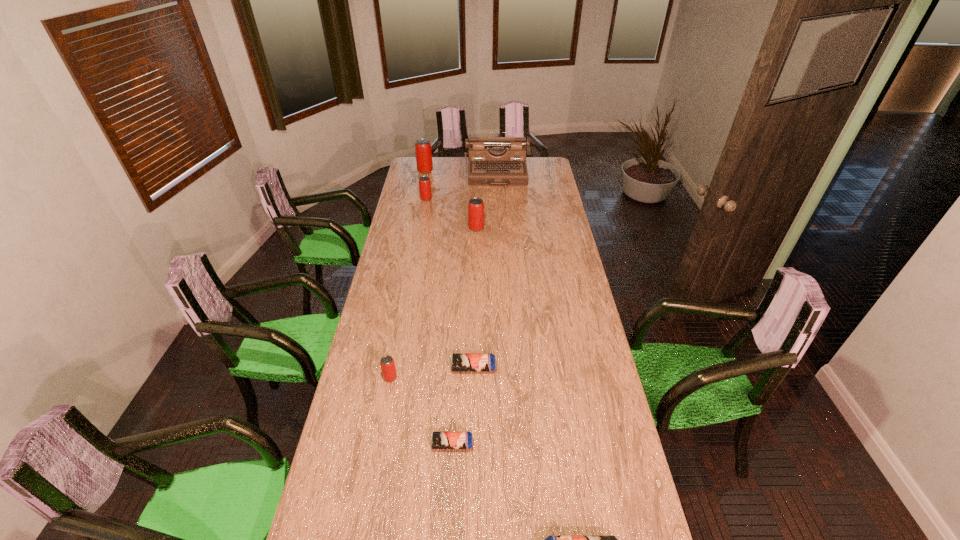
This screenshot has height=540, width=960. What are the coordinates of `typewriter located in the far edge section of the desktop` in the screenshot? It's located at (493, 161).

Find the location of a particular element. beer can at the far edge is located at coordinates (423, 151).

The image size is (960, 540). I want to click on object that is at the right edge, so click(x=493, y=161).

You are a GUI agent. You are given a task and a screenshot of the screen. Output one action in this format:
    pyautogui.click(x=<x>, y=<y>)
    Task: Click on the object that is at the far left corner
    The width and height of the screenshot is (960, 540).
    Given the screenshot: What is the action you would take?
    pyautogui.click(x=423, y=151)

Find the location of `object that is at the far right corner`. object that is at the far right corner is located at coordinates (493, 161).

Locate an element on the screen. This screenshot has height=540, width=960. vacant space at the left edge of the desktop is located at coordinates (380, 419).

The width and height of the screenshot is (960, 540). In order to click on vacant point at the right edge in this screenshot , I will do `click(552, 216)`.

In order to click on vacant space at the far left corner of the desktop in this screenshot , I will do `click(416, 161)`.

This screenshot has width=960, height=540. I want to click on free space between the farthest beer can and the second smallest blue beer can, so click(x=449, y=269).

The image size is (960, 540). I want to click on vacant region between the brown typewriter and the sixth shortest beer can, so click(x=487, y=201).